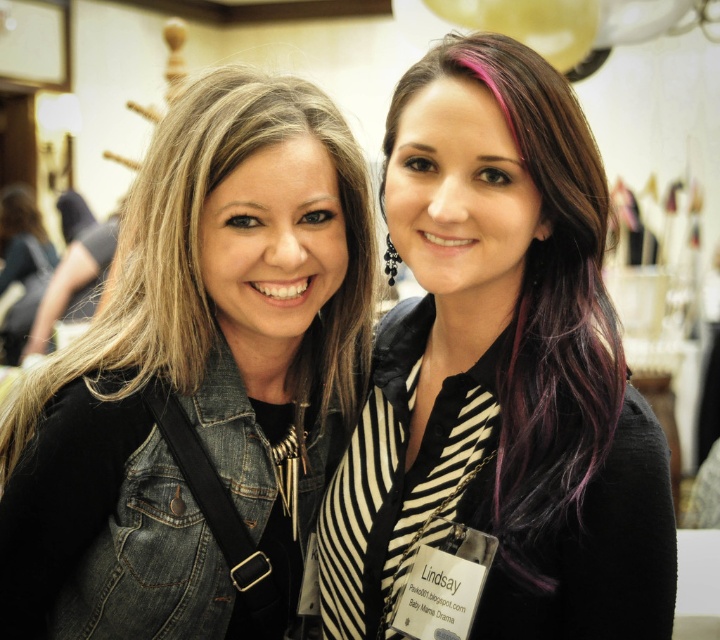
Question: Which point is closer to the camera?

Choices:
 (A) (217, 257)
 (B) (562, 148)

Answer: (B)

Question: Where is denim jacket at left located in relation to purplehair at right in the image?

Choices:
 (A) above
 (B) below

Answer: (B)

Question: In this image, where is denim jacket at left located relative to purplehair at right?

Choices:
 (A) right
 (B) left

Answer: (B)

Question: Where is denim jacket at left located in relation to purplehair at right in the image?

Choices:
 (A) right
 (B) left

Answer: (B)